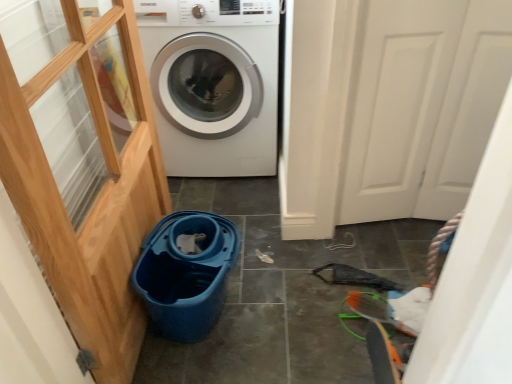
Question: Is white matte door at right looking in the opposite direction of white glossy washing machine at center?

Choices:
 (A) no
 (B) yes

Answer: (A)

Question: Does white matte door at right come behind white glossy washing machine at center?

Choices:
 (A) no
 (B) yes

Answer: (A)

Question: Is white matte door at right positioned beyond the bounds of white glossy washing machine at center?

Choices:
 (A) yes
 (B) no

Answer: (A)

Question: From the image's perspective, is white matte door at right on top of white glossy washing machine at center?

Choices:
 (A) no
 (B) yes

Answer: (A)

Question: Considering the relative sizes of white matte door at right and white glossy washing machine at center in the image provided, is white matte door at right smaller than white glossy washing machine at center?

Choices:
 (A) yes
 (B) no

Answer: (A)

Question: Considering their positions, is blue plastic bucket at lower center located in front of or behind white matte door at right?

Choices:
 (A) behind
 (B) front

Answer: (B)

Question: Considering the positions of blue plastic bucket at lower center and white matte door at right in the image, is blue plastic bucket at lower center bigger or smaller than white matte door at right?

Choices:
 (A) small
 (B) big

Answer: (A)

Question: From a real-world perspective, is blue plastic bucket at lower center positioned above or below white matte door at right?

Choices:
 (A) below
 (B) above

Answer: (A)

Question: In the image, is blue plastic bucket at lower center on the left side or the right side of white matte door at right?

Choices:
 (A) left
 (B) right

Answer: (A)

Question: Considering the positions of white glossy washing machine at center and white matte door at right in the image, is white glossy washing machine at center bigger or smaller than white matte door at right?

Choices:
 (A) big
 (B) small

Answer: (A)

Question: Is point (194, 13) closer or farther from the camera than point (368, 168)?

Choices:
 (A) farther
 (B) closer

Answer: (B)

Question: Looking at their shapes, would you say white glossy washing machine at center is wider or thinner than white matte door at right?

Choices:
 (A) wide
 (B) thin

Answer: (A)

Question: In terms of height, does white glossy washing machine at center look taller or shorter compared to white matte door at right?

Choices:
 (A) tall
 (B) short

Answer: (B)

Question: Is white matte door at right inside or outside of white glossy washing machine at center?

Choices:
 (A) outside
 (B) inside

Answer: (A)

Question: From their relative heights in the image, would you say white matte door at right is taller or shorter than white glossy washing machine at center?

Choices:
 (A) short
 (B) tall

Answer: (B)